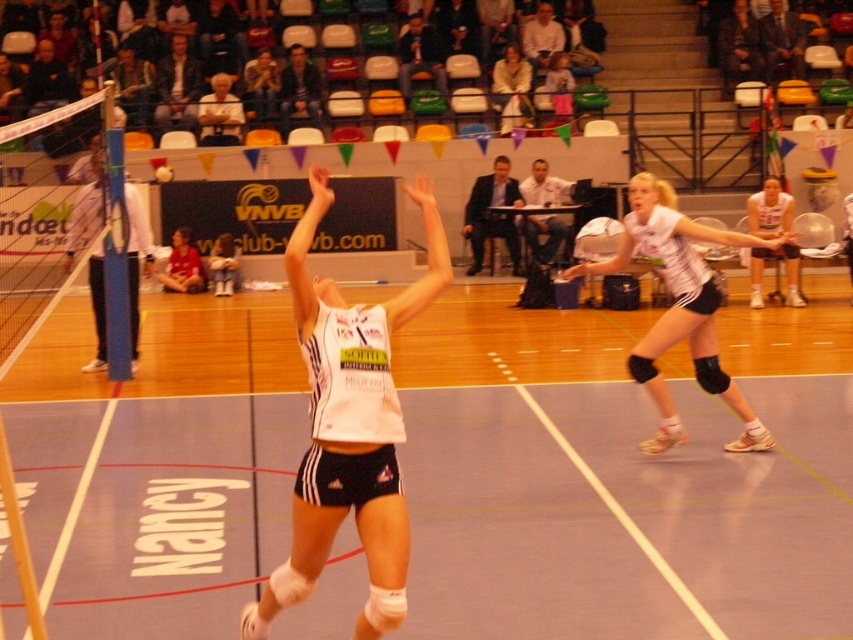
You are a volleyball coach standing on the court. You want to place a cone 5 meters away from the white mesh net at left to mark a practice zone. Is the current position of the white matte uniform at center within that 5 meter zone?

The white matte uniform at center is 7.48 meters away from the white mesh net at left, which is beyond the 5 meter mark. Therefore, the current position of the white matte uniform at center is outside the 5 meter zone.

You are a volleyball player who needs to reach the white mesh net at left from the smooth wooden floor at center. What is the minimum distance you need to cover?

The minimum distance you need to cover is 4.24 meters between smooth wooden floor at center and white mesh net at left.

You are a volleyball coach observing the game. You notice the white matte uniform at center and the white mesh net at left. Which object is closer to the right side of the court?

The white matte uniform at center is positioned on the right side of the white mesh net at left, so it is closer to the right side of the court.